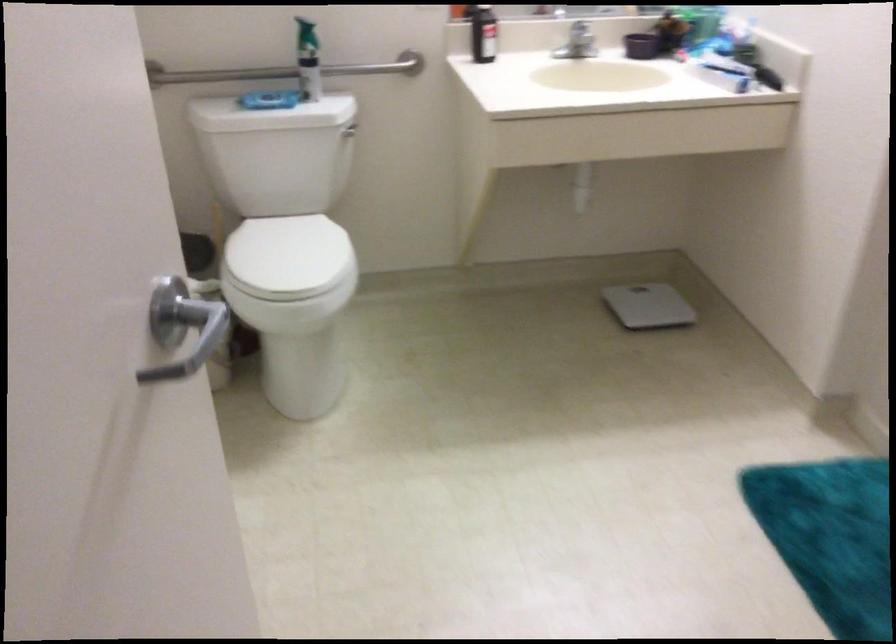
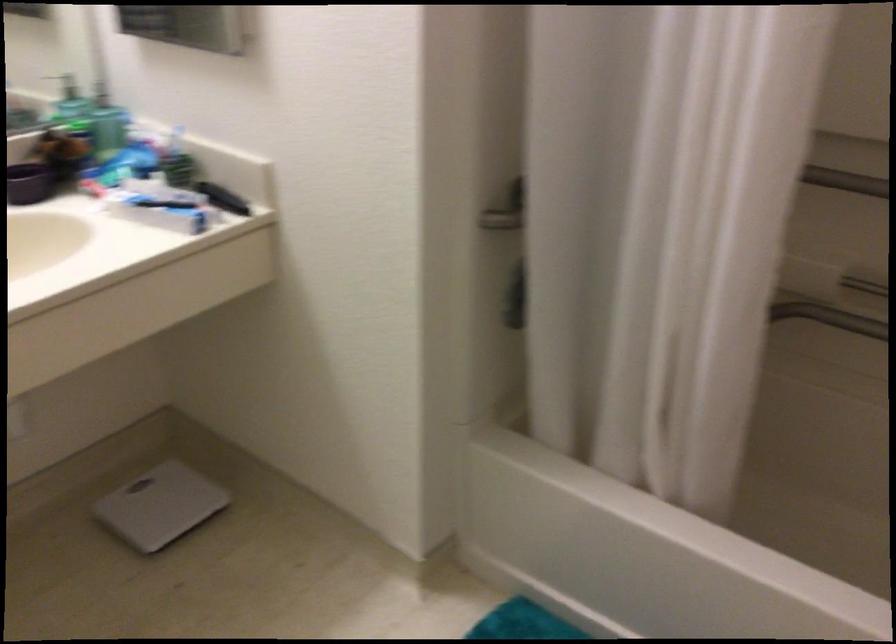
The point at [642,299] is marked in the first image. Where is the corresponding point in the second image?

(159, 506)